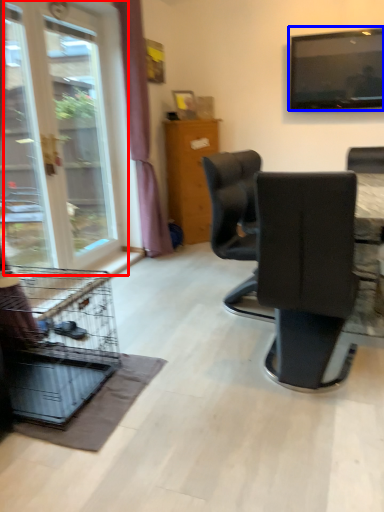
Question: Which object is closer to the camera taking this photo, window (highlighted by a red box) or television (highlighted by a blue box)?

Choices:
 (A) window
 (B) television

Answer: (A)